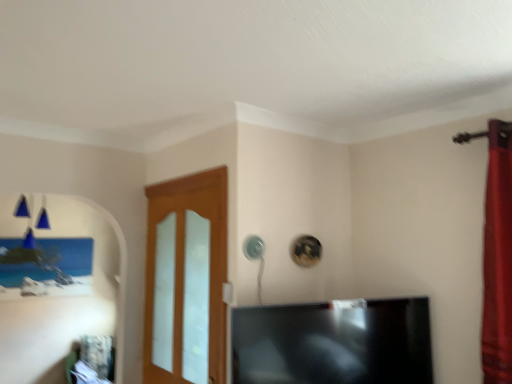
Question: Can we say light wood/glass door at center lies outside black glossy tv at center?

Choices:
 (A) yes
 (B) no

Answer: (A)

Question: Considering the relative sizes of light wood/glass door at center and black glossy tv at center in the image provided, is light wood/glass door at center shorter than black glossy tv at center?

Choices:
 (A) yes
 (B) no

Answer: (B)

Question: From the image's perspective, would you say light wood/glass door at center is positioned over black glossy tv at center?

Choices:
 (A) yes
 (B) no

Answer: (A)

Question: Considering the relative sizes of light wood/glass door at center and black glossy tv at center in the image provided, is light wood/glass door at center bigger than black glossy tv at center?

Choices:
 (A) no
 (B) yes

Answer: (A)

Question: Does light wood/glass door at center have a greater height compared to black glossy tv at center?

Choices:
 (A) yes
 (B) no

Answer: (A)

Question: Would you say light wood/glass door at center is a long distance from black glossy tv at center?

Choices:
 (A) no
 (B) yes

Answer: (A)

Question: Is black glossy tv at center surrounding light wood/glass door at center?

Choices:
 (A) no
 (B) yes

Answer: (A)

Question: Is black glossy tv at center to the left of light wood/glass door at center from the viewer's perspective?

Choices:
 (A) no
 (B) yes

Answer: (A)

Question: Considering the relative sizes of black glossy tv at center and light wood/glass door at center in the image provided, is black glossy tv at center bigger than light wood/glass door at center?

Choices:
 (A) no
 (B) yes

Answer: (B)

Question: Is black glossy tv at center positioned in front of light wood/glass door at center?

Choices:
 (A) yes
 (B) no

Answer: (A)

Question: Is black glossy tv at center taller than light wood/glass door at center?

Choices:
 (A) yes
 (B) no

Answer: (B)

Question: Does black glossy tv at center come behind light wood/glass door at center?

Choices:
 (A) yes
 (B) no

Answer: (B)

Question: Is black glossy tv at center bigger or smaller than light wood/glass door at center?

Choices:
 (A) small
 (B) big

Answer: (B)